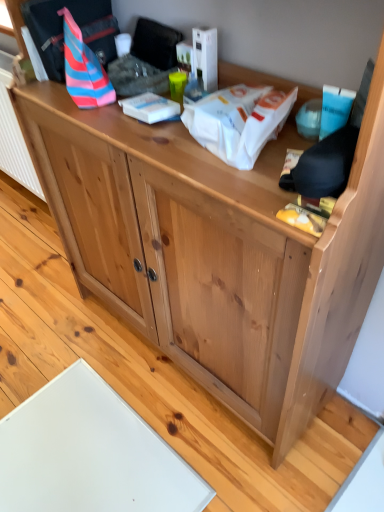
This screenshot has width=384, height=512. What do you see at coordinates (83, 68) in the screenshot?
I see `striped fabric bag at upper left, marked as the 1th kit in a left-to-right arrangement` at bounding box center [83, 68].

At what (x,y) coordinates should I click in order to perform the action: click on striped fabric bag at upper left, the 2th kit viewed from the right. Please return your answer as a coordinate pair (x, y). Looking at the image, I should click on (83, 68).

Measure the distance between point (100, 86) and camera.

A distance of 94.60 centimeters exists between point (100, 86) and camera.

Measure the distance between striped fabric bag at upper left, the 2th kit viewed from the right, and camera.

striped fabric bag at upper left, the 2th kit viewed from the right, and camera are 90.67 centimeters apart.

What do you see at coordinates (238, 121) in the screenshot? The height and width of the screenshot is (512, 384). I see `white paper at upper center, arranged as the first kit when viewed from the right` at bounding box center [238, 121].

Where is `white paper at upper center, arranged as the first kit when viewed from the right`? This screenshot has width=384, height=512. white paper at upper center, arranged as the first kit when viewed from the right is located at coordinates (238, 121).

The height and width of the screenshot is (512, 384). What are the coordinates of `striped fabric bag at upper left, the 2th kit viewed from the right` in the screenshot? It's located at (83, 68).

Considering the positions of objects white paper at upper center, arranged as the first kit when viewed from the right, and striped fabric bag at upper left, marked as the 1th kit in a left-to-right arrangement, in the image provided, who is more to the left, white paper at upper center, arranged as the first kit when viewed from the right, or striped fabric bag at upper left, marked as the 1th kit in a left-to-right arrangement,?

striped fabric bag at upper left, marked as the 1th kit in a left-to-right arrangement, is more to the left.

Is white paper at upper center, the 2th kit from the left, further to camera compared to striped fabric bag at upper left, marked as the 1th kit in a left-to-right arrangement?

No, the depth of white paper at upper center, the 2th kit from the left, is less than that of striped fabric bag at upper left, marked as the 1th kit in a left-to-right arrangement.

Considering the points (251, 146) and (81, 78), which point is in front, point (251, 146) or point (81, 78)?

Positioned in front is point (251, 146).

From the image's perspective, between white paper at upper center, the 2th kit from the left, and striped fabric bag at upper left, marked as the 1th kit in a left-to-right arrangement, which one is located above?

striped fabric bag at upper left, marked as the 1th kit in a left-to-right arrangement, from the image's perspective.

From a real-world perspective, which object rests below the other?

white paper at upper center, arranged as the first kit when viewed from the right, is physically lower.

Between white paper at upper center, arranged as the first kit when viewed from the right, and striped fabric bag at upper left, the 2th kit viewed from the right, which one has smaller width?

With smaller width is striped fabric bag at upper left, the 2th kit viewed from the right.

Considering the sizes of objects white paper at upper center, the 2th kit from the left, and striped fabric bag at upper left, marked as the 1th kit in a left-to-right arrangement, in the image provided, who is shorter, white paper at upper center, the 2th kit from the left, or striped fabric bag at upper left, marked as the 1th kit in a left-to-right arrangement,?

With less height is white paper at upper center, the 2th kit from the left.

Based on the photo, which of these two, white paper at upper center, arranged as the first kit when viewed from the right, or striped fabric bag at upper left, marked as the 1th kit in a left-to-right arrangement, is smaller?

Smaller between the two is white paper at upper center, arranged as the first kit when viewed from the right.

Is white paper at upper center, arranged as the first kit when viewed from the right, surrounding striped fabric bag at upper left, marked as the 1th kit in a left-to-right arrangement?

Definitely not — striped fabric bag at upper left, marked as the 1th kit in a left-to-right arrangement, is not inside white paper at upper center, arranged as the first kit when viewed from the right.

Is white paper at upper center, the 2th kit from the left, in contact with striped fabric bag at upper left, marked as the 1th kit in a left-to-right arrangement?

No, white paper at upper center, the 2th kit from the left, is not with striped fabric bag at upper left, marked as the 1th kit in a left-to-right arrangement.

Is white paper at upper center, arranged as the first kit when viewed from the right, turned away from striped fabric bag at upper left, marked as the 1th kit in a left-to-right arrangement?

No, white paper at upper center, arranged as the first kit when viewed from the right, is not facing away from striped fabric bag at upper left, marked as the 1th kit in a left-to-right arrangement.

How different are the orientations of white paper at upper center, arranged as the first kit when viewed from the right, and striped fabric bag at upper left, marked as the 1th kit in a left-to-right arrangement, in degrees?

white paper at upper center, arranged as the first kit when viewed from the right, and striped fabric bag at upper left, marked as the 1th kit in a left-to-right arrangement, are facing 27.5 degrees away from each other.

How much distance is there between white paper at upper center, the 2th kit from the left, and striped fabric bag at upper left, marked as the 1th kit in a left-to-right arrangement?

A distance of 12.79 inches exists between white paper at upper center, the 2th kit from the left, and striped fabric bag at upper left, marked as the 1th kit in a left-to-right arrangement.

At what (x,y) coordinates should I click in order to perform the action: click on kit that appears below the striped fabric bag at upper left, the 2th kit viewed from the right (from the image's perspective). Please return your answer as a coordinate pair (x, y). The height and width of the screenshot is (512, 384). Looking at the image, I should click on tap(238, 121).

Is striped fabric bag at upper left, the 2th kit viewed from the right, at the left side of white paper at upper center, the 2th kit from the left?

Indeed, striped fabric bag at upper left, the 2th kit viewed from the right, is positioned on the left side of white paper at upper center, the 2th kit from the left.

Is striped fabric bag at upper left, marked as the 1th kit in a left-to-right arrangement, behind white paper at upper center, arranged as the first kit when viewed from the right?

Yes, it is behind white paper at upper center, arranged as the first kit when viewed from the right.

Does point (86, 74) lie in front of point (207, 143)?

That is False.

From the image's perspective, is striped fabric bag at upper left, the 2th kit viewed from the right, above or below white paper at upper center, arranged as the first kit when viewed from the right?

Based on their image positions, striped fabric bag at upper left, the 2th kit viewed from the right, is located above white paper at upper center, arranged as the first kit when viewed from the right.

From a real-world perspective, does striped fabric bag at upper left, the 2th kit viewed from the right, stand above white paper at upper center, the 2th kit from the left?

Yes, from a real-world perspective, striped fabric bag at upper left, the 2th kit viewed from the right, is above white paper at upper center, the 2th kit from the left.

Considering the sizes of objects striped fabric bag at upper left, the 2th kit viewed from the right, and white paper at upper center, arranged as the first kit when viewed from the right, in the image provided, who is thinner, striped fabric bag at upper left, the 2th kit viewed from the right, or white paper at upper center, arranged as the first kit when viewed from the right,?

Thinner between the two is striped fabric bag at upper left, the 2th kit viewed from the right.

Which of these two, striped fabric bag at upper left, the 2th kit viewed from the right, or white paper at upper center, arranged as the first kit when viewed from the right, stands taller?

With more height is striped fabric bag at upper left, the 2th kit viewed from the right.

Which of these two, striped fabric bag at upper left, marked as the 1th kit in a left-to-right arrangement, or white paper at upper center, the 2th kit from the left, is smaller?

white paper at upper center, the 2th kit from the left.

Can white paper at upper center, arranged as the first kit when viewed from the right, be found inside striped fabric bag at upper left, the 2th kit viewed from the right?

No, white paper at upper center, arranged as the first kit when viewed from the right, is not a part of striped fabric bag at upper left, the 2th kit viewed from the right.

Is striped fabric bag at upper left, marked as the 1th kit in a left-to-right arrangement, touching white paper at upper center, the 2th kit from the left?

No, striped fabric bag at upper left, marked as the 1th kit in a left-to-right arrangement, is not making contact with white paper at upper center, the 2th kit from the left.

Is striped fabric bag at upper left, the 2th kit viewed from the right, oriented away from white paper at upper center, arranged as the first kit when viewed from the right?

No, striped fabric bag at upper left, the 2th kit viewed from the right, is not facing the opposite direction of white paper at upper center, arranged as the first kit when viewed from the right.

How many degrees apart are the facing directions of striped fabric bag at upper left, marked as the 1th kit in a left-to-right arrangement, and white paper at upper center, the 2th kit from the left?

The facing directions of striped fabric bag at upper left, marked as the 1th kit in a left-to-right arrangement, and white paper at upper center, the 2th kit from the left, are 27.5 degrees apart.

How far apart are striped fabric bag at upper left, the 2th kit viewed from the right, and white paper at upper center, the 2th kit from the left?

striped fabric bag at upper left, the 2th kit viewed from the right, is 12.79 inches from white paper at upper center, the 2th kit from the left.

Locate an element on the screen. The width and height of the screenshot is (384, 512). kit below the striped fabric bag at upper left, the 2th kit viewed from the right (from the image's perspective) is located at coordinates (238, 121).

Identify the location of kit on the left of white paper at upper center, the 2th kit from the left. (83, 68).

Image resolution: width=384 pixels, height=512 pixels. I want to click on kit below the striped fabric bag at upper left, marked as the 1th kit in a left-to-right arrangement (from a real-world perspective), so click(238, 121).